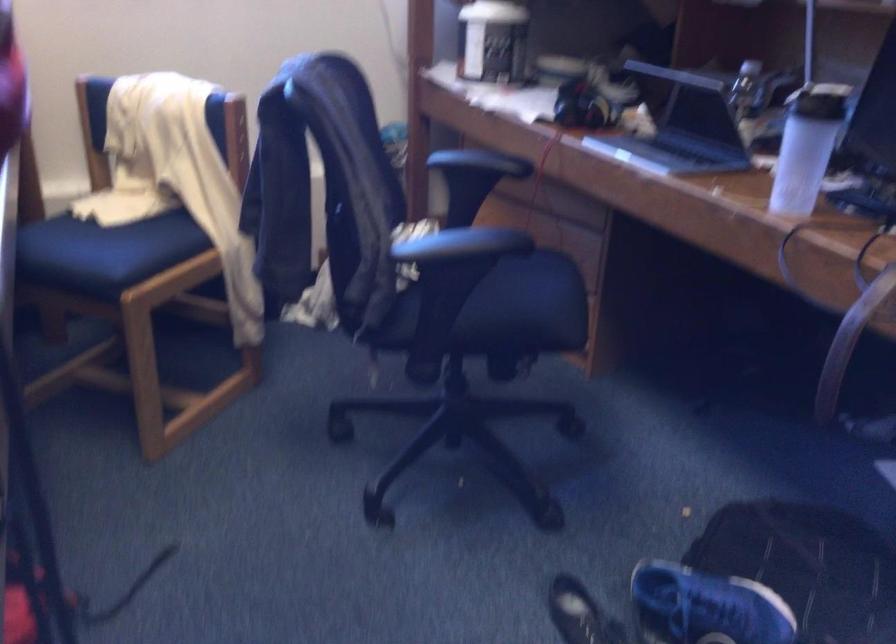
Where would you sit the black chair sitting surface? Please return your answer as a coordinate pair (x, y).

(515, 313)